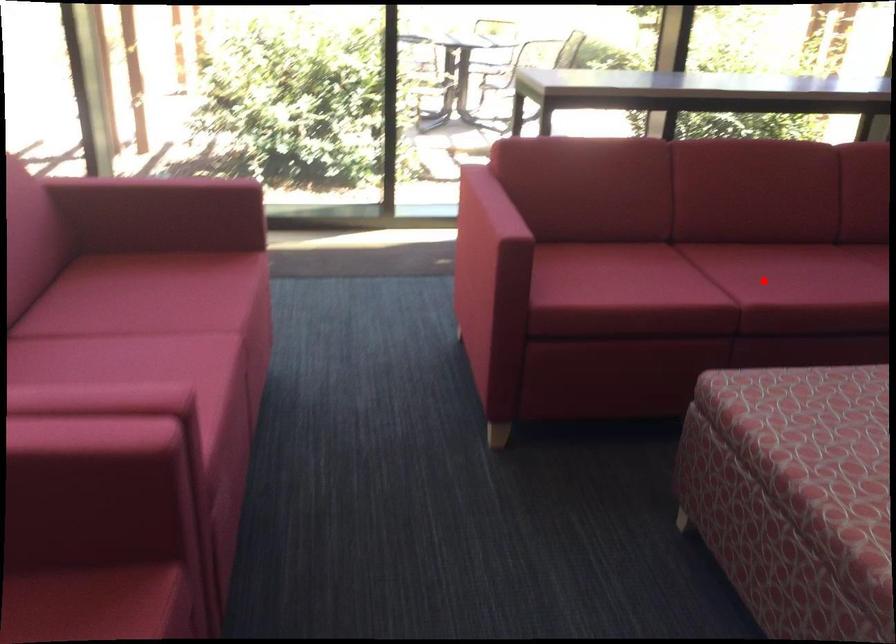
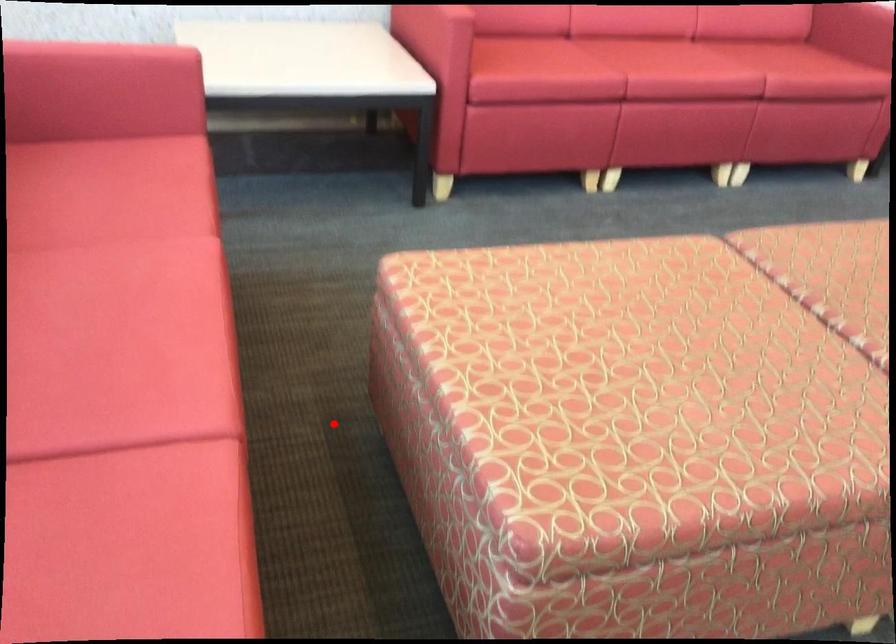
I am providing you with two images of the same scene from different viewpoints. A red point is marked on the first image and another point is marked on the second image. Are the points marked in image1 and image2 representing the same 3D position?

No